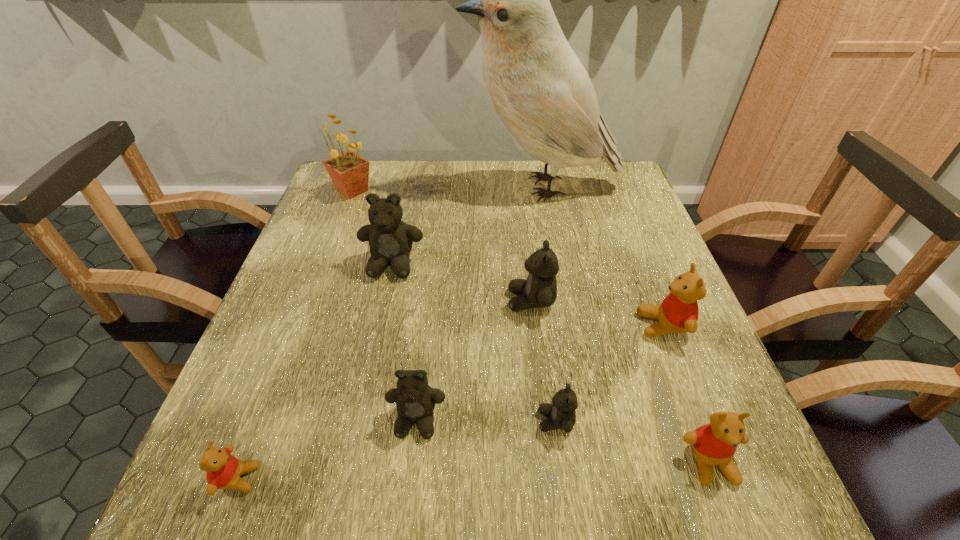
Identify the location of free space located on the front-facing side of the biggest red teddy bear. (443, 325).

I want to click on vacant position located 0.270m on the front-facing side of the biggest red teddy bear, so (x=507, y=325).

Locate an element on the screen. The width and height of the screenshot is (960, 540). free region located 0.220m on the front-facing side of the biggest red teddy bear is located at coordinates (531, 325).

I want to click on vacant space located 0.110m on the face of the second smallest brown teddy bear, so click(406, 515).

The width and height of the screenshot is (960, 540). In order to click on free region located on the face of the smallest brown teddy bear in this screenshot , I will do `click(502, 421)`.

Find the location of a particular element. free space located 0.130m on the face of the smallest brown teddy bear is located at coordinates (461, 421).

Locate an element on the screen. This screenshot has height=540, width=960. blank space located on the face of the smallest brown teddy bear is located at coordinates (314, 421).

This screenshot has height=540, width=960. I want to click on vacant space located on the front-facing side of the smallest red teddy bear, so click(x=309, y=478).

Locate an element on the screen. The image size is (960, 540). parakeet present at the far edge is located at coordinates (536, 84).

This screenshot has height=540, width=960. What are the coordinates of `sunflower present at the far edge` in the screenshot? It's located at (349, 172).